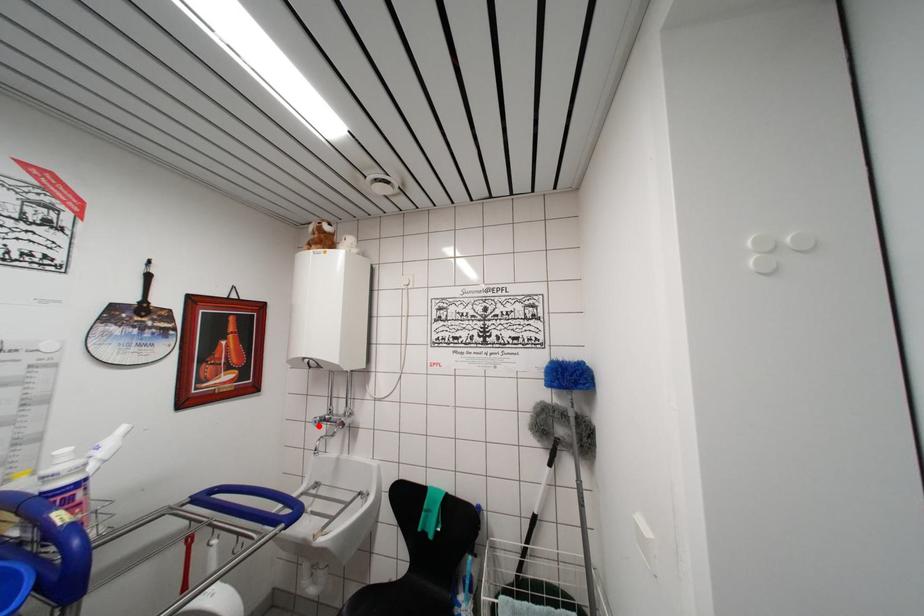
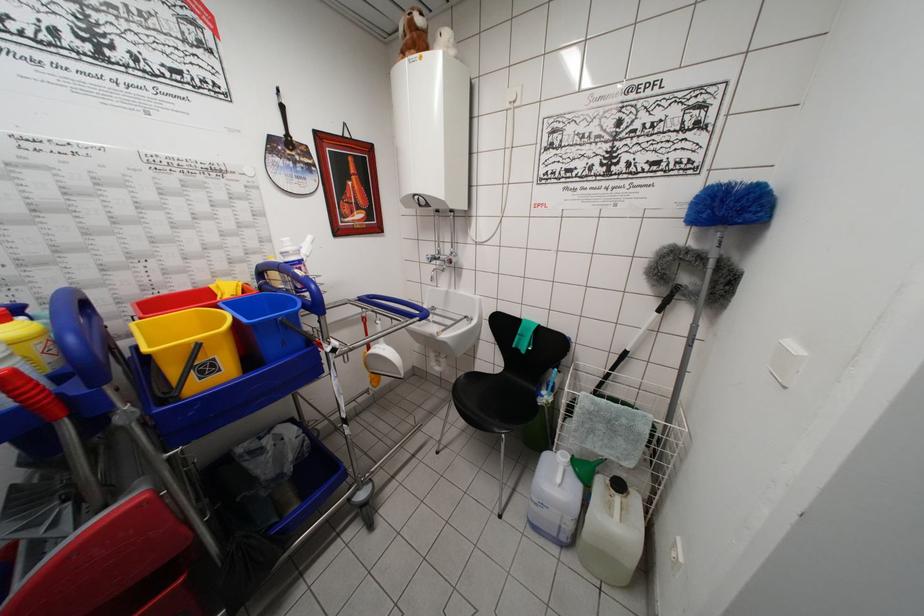
Question: A red point is marked in image1. In image2, is the corresponding 3D point closer to the camera or farther? Reply with the corresponding letter.

Choices:
 (A) The corresponding 3D point is closer.
 (B) The corresponding 3D point is farther.

Answer: (A)